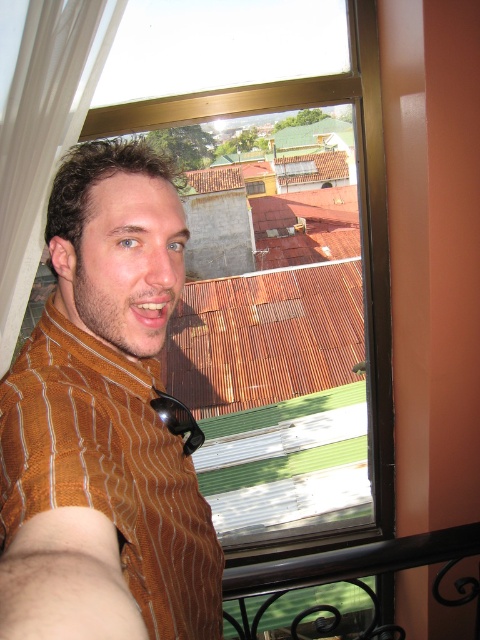
Is the position of brown striped shirt at center more distant than that of black wrought iron at lower right?

No, brown striped shirt at center is closer to the viewer.

Does brown striped shirt at center come in front of black wrought iron at lower right?

That is True.

Measure the distance between point (96, 547) and camera.

21.71 inches

The width and height of the screenshot is (480, 640). In order to click on brown striped shirt at center in this screenshot , I will do `click(104, 422)`.